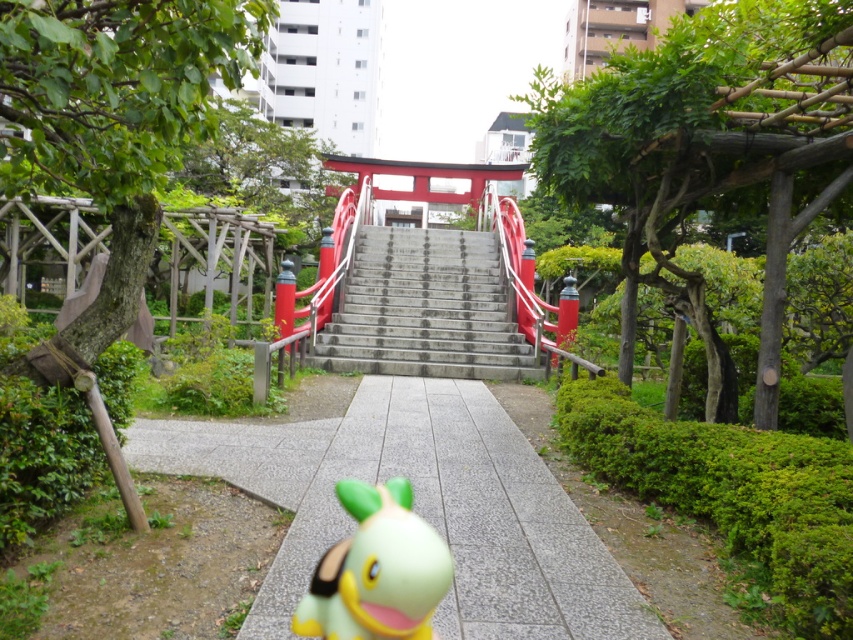
Question: Considering the real-world distances, which object is farthest from the smooth concrete stairs at center?

Choices:
 (A) smooth concrete path at center
 (B) green rubber toy at center

Answer: (B)

Question: Does smooth concrete stairs at center have a smaller size compared to green rubber toy at center?

Choices:
 (A) yes
 (B) no

Answer: (B)

Question: Among these points, which one is farthest from the camera?

Choices:
 (A) (396, 531)
 (B) (398, 250)
 (C) (381, 388)

Answer: (B)

Question: Does smooth concrete stairs at center appear on the right side of green rubber toy at center?

Choices:
 (A) no
 (B) yes

Answer: (B)

Question: Is smooth concrete stairs at center above green rubber toy at center?

Choices:
 (A) yes
 (B) no

Answer: (A)

Question: Among these objects, which one is nearest to the camera?

Choices:
 (A) green rubber toy at center
 (B) smooth concrete path at center

Answer: (A)